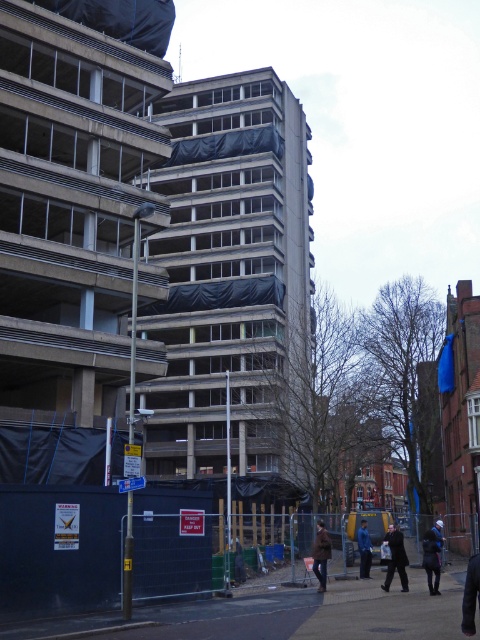
Is brown woolen coat at lower right positioned at the back of blue denim jacket at lower right?

No, brown woolen coat at lower right is in front of blue denim jacket at lower right.

Describe the element at coordinates (321, 554) in the screenshot. I see `brown woolen coat at lower right` at that location.

Identify the location of brown woolen coat at lower right. (321, 554).

Between brown woolen coat at lower right and dark blue jacket at lower right, which one appears on the left side from the viewer's perspective?

brown woolen coat at lower right is more to the left.

Is brown woolen coat at lower right positioned before dark blue jacket at lower right?

Answer: No, it is behind dark blue jacket at lower right.

Is point (325, 548) positioned after point (436, 545)?

Yes, it is behind point (436, 545).

This screenshot has height=640, width=480. Identify the location of brown woolen coat at lower right. (321, 554).

Is dark gray coat at center to the right of blue denim jacket at lower right from the viewer's perspective?

Correct, you'll find dark gray coat at center to the right of blue denim jacket at lower right.

Does dark gray coat at center have a greater height compared to blue denim jacket at lower right?

Correct, dark gray coat at center is much taller as blue denim jacket at lower right.

At what (x,y) coordinates should I click in order to perform the action: click on dark gray coat at center. Please return your answer as a coordinate pair (x, y). Looking at the image, I should click on (396, 557).